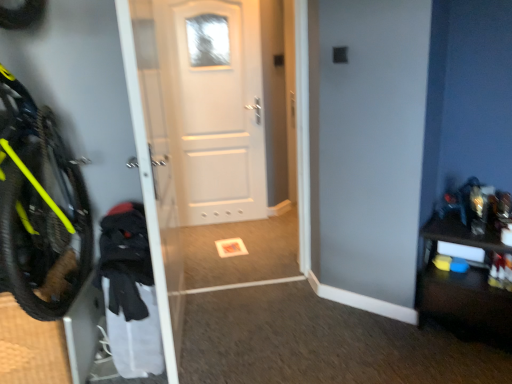
Question: Does point (476, 236) appear closer or farther from the camera than point (167, 34)?

Choices:
 (A) farther
 (B) closer

Answer: (B)

Question: Based on their positions, is dark wood dresser at right located to the left or right of white matte door at center?

Choices:
 (A) left
 (B) right

Answer: (B)

Question: From the image's perspective, is dark wood dresser at right located above or below white matte door at center?

Choices:
 (A) above
 (B) below

Answer: (B)

Question: From the image's perspective, is white matte door at center positioned above or below dark wood dresser at right?

Choices:
 (A) below
 (B) above

Answer: (B)

Question: Does point (182, 135) appear closer or farther from the camera than point (451, 326)?

Choices:
 (A) farther
 (B) closer

Answer: (A)

Question: In the image, is white matte door at center on the left side or the right side of dark wood dresser at right?

Choices:
 (A) left
 (B) right

Answer: (A)

Question: From a real-world perspective, is white matte door at center positioned above or below dark wood dresser at right?

Choices:
 (A) above
 (B) below

Answer: (A)